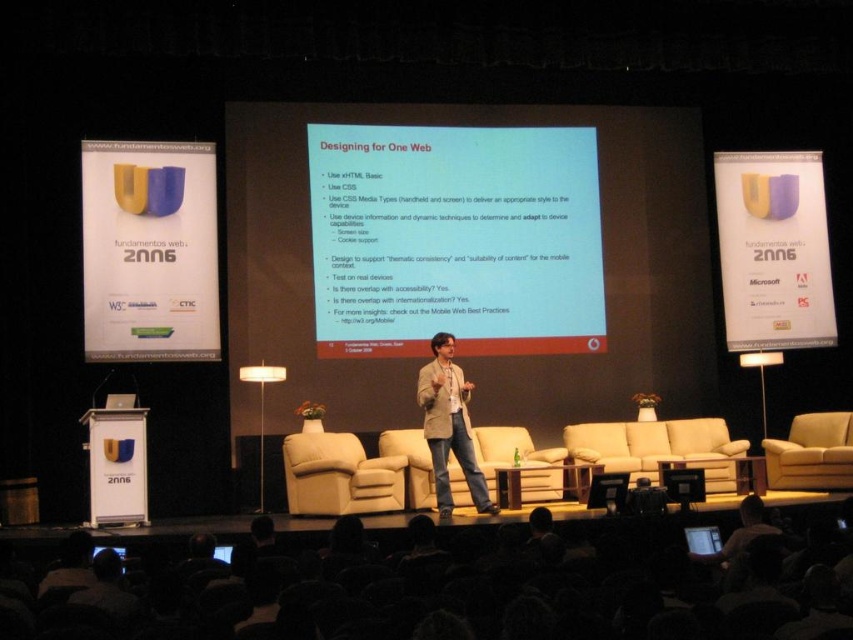
Question: Does purple paper at upper center have a lesser width compared to light beige blazer at center?

Choices:
 (A) no
 (B) yes

Answer: (B)

Question: Which of the following is the closest to the observer?

Choices:
 (A) (791, 449)
 (B) (816, 346)
 (C) (614, 493)
 (D) (115, 552)

Answer: (D)

Question: Among these objects, which one is nearest to the camera?

Choices:
 (A) black glossy screen at center
 (B) matte black screen at lower center
 (C) light beige blazer at center
 (D) white paper at center

Answer: (B)

Question: Among these objects, which one is nearest to the camera?

Choices:
 (A) matte black screen at center
 (B) purple paper at upper center
 (C) matte black screen at lower center
 (D) black glossy screen at center

Answer: (A)

Question: Does white paper at center appear over light beige blazer at center?

Choices:
 (A) yes
 (B) no

Answer: (A)

Question: Is yellow matte sign at upper left wider than light beige leather armchair at center?

Choices:
 (A) no
 (B) yes

Answer: (A)